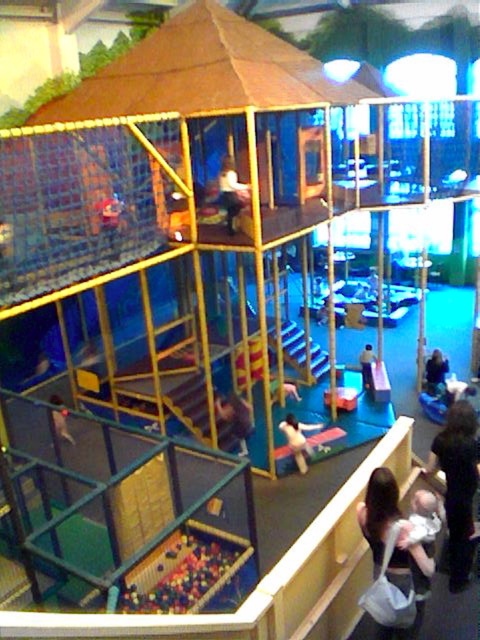
Who is higher up, multicolored plastic balls at lower center or smooth white shirt at center?

smooth white shirt at center is above.

Who is shorter, multicolored plastic balls at lower center or smooth white shirt at center?

Standing shorter between the two is multicolored plastic balls at lower center.

Which is in front, point (143, 573) or point (370, 360)?

Point (143, 573) is more forward.

Find the location of a particular element. multicolored plastic balls at lower center is located at coordinates (183, 572).

Who is shorter, smooth brown hair at center or smooth blue fabric at center?

smooth blue fabric at center

Which is above, smooth brown hair at center or smooth blue fabric at center?

smooth brown hair at center is higher up.

The width and height of the screenshot is (480, 640). I want to click on smooth brown hair at center, so click(235, 419).

At what (x,y) coordinates should I click in order to perform the action: click on smooth brown hair at center. Please return your answer as a coordinate pair (x, y). The width and height of the screenshot is (480, 640). Looking at the image, I should click on (235, 419).

In the scene shown: How far apart are dark blue fabric at lower right and smooth white shirt at center?

A distance of 1.22 meters exists between dark blue fabric at lower right and smooth white shirt at center.

Between point (428, 376) and point (368, 371), which one is positioned in front?

Point (428, 376)

The image size is (480, 640). Describe the element at coordinates (435, 371) in the screenshot. I see `dark blue fabric at lower right` at that location.

Identify the location of dark blue fabric at lower right. Image resolution: width=480 pixels, height=640 pixels. (435, 371).